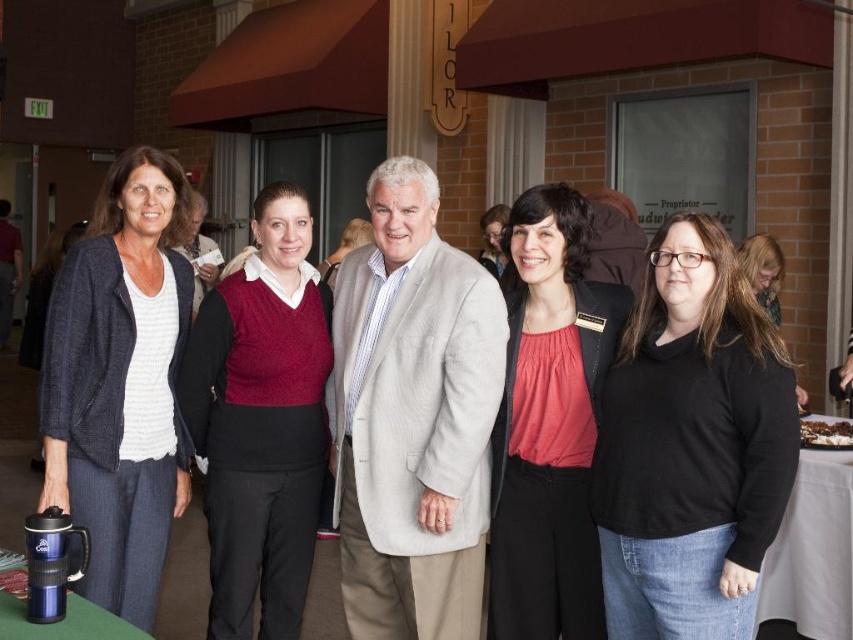
Question: Is matte black jacket at center to the right of matte red sweater at center from the viewer's perspective?

Choices:
 (A) yes
 (B) no

Answer: (A)

Question: Which point is closer to the camera?

Choices:
 (A) matte black jacket at left
 (B) matte black jacket at center

Answer: (A)

Question: Considering the real-world distances, which object is closest to the matte black jacket at center?

Choices:
 (A) knitted maroon sweater at center
 (B) blonde hair at center
 (C) white cloth table at lower right
 (D) matte black jacket at left

Answer: (A)

Question: Is matte black jacket at left to the left of white cloth table at lower right from the viewer's perspective?

Choices:
 (A) no
 (B) yes

Answer: (B)

Question: Considering the relative positions of black matte sweater at center and matte black jacket at left in the image provided, where is black matte sweater at center located with respect to matte black jacket at left?

Choices:
 (A) right
 (B) left

Answer: (A)

Question: Among these objects, which one is nearest to the camera?

Choices:
 (A) knitted maroon sweater at center
 (B) matte red sweater at center

Answer: (A)